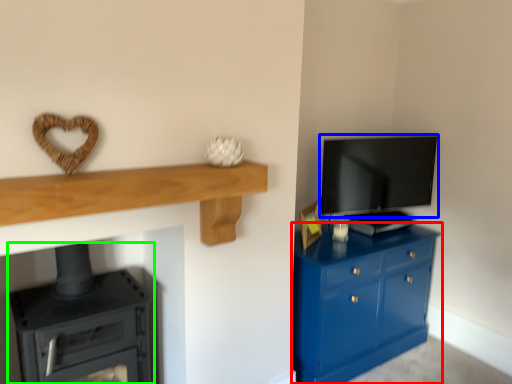
Question: Considering the real-world distances, which object is farthest from chest of drawers (highlighted by a red box)? television (highlighted by a blue box) or stove (highlighted by a green box)?

Choices:
 (A) television
 (B) stove

Answer: (B)